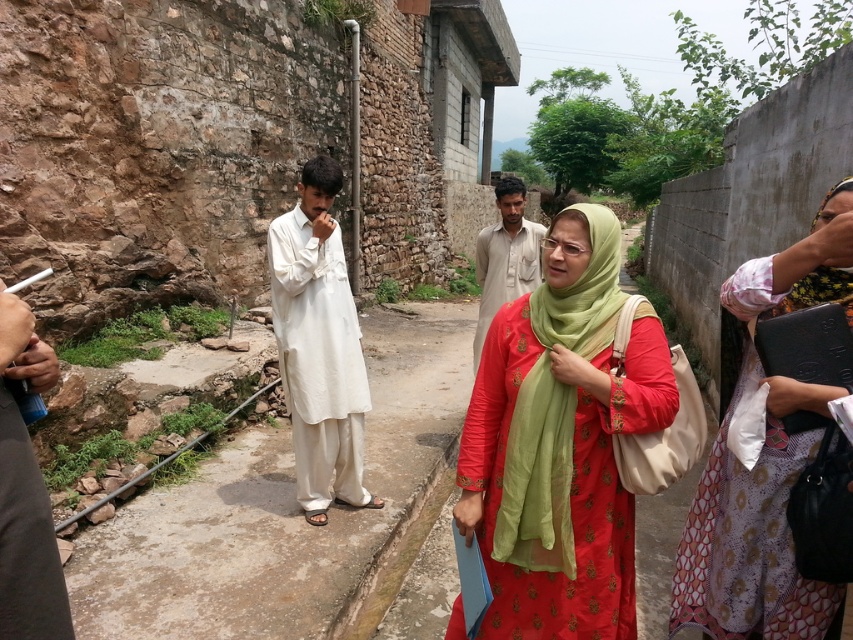
Is white cotton shirt at center taller than light brown cotton shirt at center?

No.

Can you confirm if white cotton shirt at center is positioned to the right of light brown cotton shirt at center?

Incorrect, white cotton shirt at center is not on the right side of light brown cotton shirt at center.

What are the coordinates of `white cotton shirt at center` in the screenshot? It's located at (281, 509).

Does matte red dress at center have a larger size compared to white cotton kurta at center?

Yes.

Is point (498, 516) closer to viewer compared to point (332, 221)?

Yes, it is in front of point (332, 221).

Is point (596, 529) positioned before point (334, 186)?

Yes, point (596, 529) is in front of point (334, 186).

You are a GUI agent. You are given a task and a screenshot of the screen. Output one action in this format:
    pyautogui.click(x=<x>, y=<y>)
    Task: Click on the matte red dress at center
    This screenshot has height=640, width=853.
    Given the screenshot: What is the action you would take?
    pyautogui.click(x=561, y=442)

Which is behind, point (793, 276) or point (48, 365)?

Positioned behind is point (793, 276).

Who is positioned more to the right, patterned fabric dress at right or metallic blue can at left?

From the viewer's perspective, patterned fabric dress at right appears more on the right side.

Does point (747, 564) lie behind point (20, 522)?

Yes.

In order to click on patterned fabric dress at right in this screenshot , I will do `click(753, 529)`.